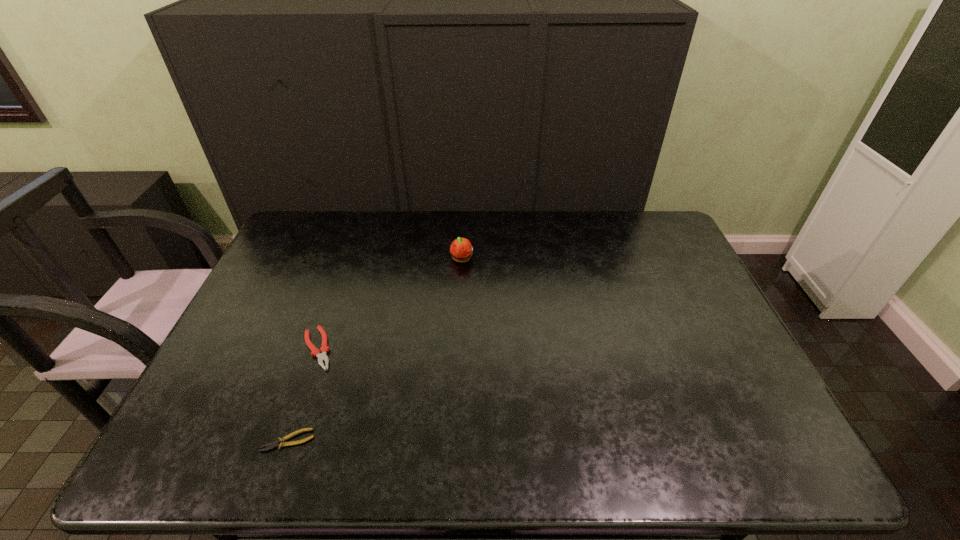
Identify the location of free spot between the shorter pliers and the farther pliers. (303, 395).

The image size is (960, 540). Find the location of `unoccupied position between the nearest object and the farthest object`. unoccupied position between the nearest object and the farthest object is located at coordinates (374, 350).

Locate an element on the screen. free space between the tallest object and the farther pliers is located at coordinates (390, 304).

The width and height of the screenshot is (960, 540). What are the coordinates of `empty location between the taller pliers and the shorter pliers` in the screenshot? It's located at (303, 395).

The image size is (960, 540). I want to click on vacant space that's between the second tallest object and the shortest object, so click(303, 395).

Find the location of `object that can be found as the second closest to the shortest object`. object that can be found as the second closest to the shortest object is located at coordinates pos(461,249).

The image size is (960, 540). In order to click on object that is the nearest to the apple in this screenshot , I will do `click(315, 352)`.

Where is `free location that satisfies the following two spatial constraints: 1. on the back side of the nearest object; 2. on the right side of the rightmost object`? free location that satisfies the following two spatial constraints: 1. on the back side of the nearest object; 2. on the right side of the rightmost object is located at coordinates (350, 259).

You are a GUI agent. You are given a task and a screenshot of the screen. Output one action in this format:
    pyautogui.click(x=<x>, y=<y>)
    Task: Click on the vacant region that satisfies the following two spatial constraints: 1. on the back side of the apple; 2. on the left side of the taller pliers
    This screenshot has height=540, width=960.
    Given the screenshot: What is the action you would take?
    click(348, 259)

The image size is (960, 540). Identify the location of vacant region that satisfies the following two spatial constraints: 1. on the back side of the apple; 2. on the right side of the taller pliers. (348, 259).